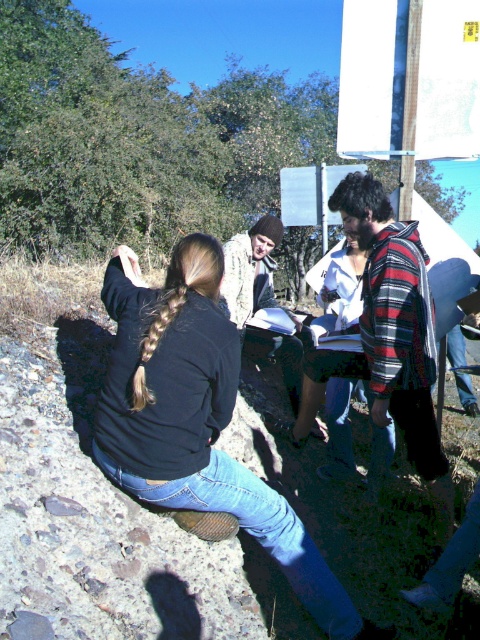
Who is lower down, flannel shirt at center or camouflage-patterned jacket at center?

flannel shirt at center is below.

Where is `flannel shirt at center`? The image size is (480, 640). flannel shirt at center is located at coordinates tap(387, 336).

Is point (405, 410) more distant than point (273, 260)?

No, it is in front of (273, 260).

Identify the location of flannel shirt at center. Image resolution: width=480 pixels, height=640 pixels. (387, 336).

Is black matte jacket at lower left to the right of camouflage-patterned jacket at center from the viewer's perspective?

In fact, black matte jacket at lower left is to the left of camouflage-patterned jacket at center.

Is point (120, 250) farther from viewer compared to point (224, 244)?

No, (120, 250) is in front of (224, 244).

Locate an element on the screen. Image resolution: width=480 pixels, height=640 pixels. black matte jacket at lower left is located at coordinates [x=197, y=420].

Does black matte jacket at lower left have a larger size compared to flannel shirt at center?

No, black matte jacket at lower left is not bigger than flannel shirt at center.

Is point (277, 531) farther from viewer compared to point (392, 248)?

No, it is in front of (392, 248).

Where is `black matte jacket at lower left`? black matte jacket at lower left is located at coordinates (197, 420).